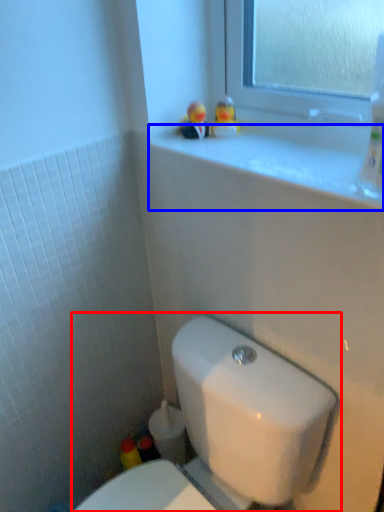
Question: Which object appears farthest to the camera in this image, toilet (highlighted by a red box) or window sill (highlighted by a blue box)?

Choices:
 (A) toilet
 (B) window sill

Answer: (B)